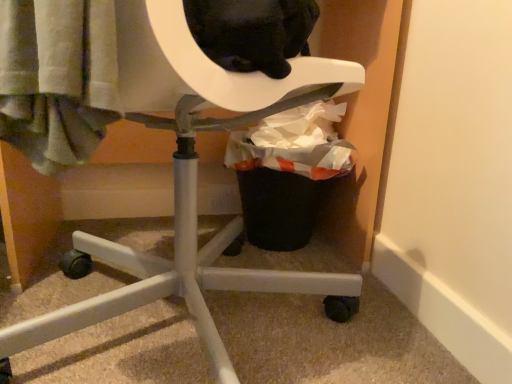
This screenshot has height=384, width=512. Find the location of `white plastic chair at center`. white plastic chair at center is located at coordinates coord(149,127).

What is the approximate width of white plastic chair at center?

24.97 inches.

This screenshot has height=384, width=512. What do you see at coordinates (149, 127) in the screenshot?
I see `white plastic chair at center` at bounding box center [149, 127].

The height and width of the screenshot is (384, 512). Describe the element at coordinates (287, 172) in the screenshot. I see `black plastic trash can at lower right` at that location.

At what (x,y) coordinates should I click in order to perform the action: click on black plastic trash can at lower right. Please return your answer as a coordinate pair (x, y). The image size is (512, 384). Looking at the image, I should click on (287, 172).

Measure the distance between black plastic trash can at lower right and camera.

36.66 inches.

In order to face black plastic trash can at lower right, should I rotate leftwards or rightwards?

To align with it, rotate right about 4.078°.

In order to click on white plastic chair at center in this screenshot , I will do `click(149, 127)`.

Which is more to the left, black plastic trash can at lower right or white plastic chair at center?

white plastic chair at center.

Is black plastic trash can at lower right in front of or behind white plastic chair at center in the image?

black plastic trash can at lower right is behind white plastic chair at center.

Which is closer to the camera, (306, 123) or (55, 30)?

Point (306, 123) is farther from the camera than point (55, 30).

Looking at this image, from the image's perspective, which is below, black plastic trash can at lower right or white plastic chair at center?

From the image's view, white plastic chair at center is below.

From a real-world perspective, who is located lower, black plastic trash can at lower right or white plastic chair at center?

black plastic trash can at lower right.

Considering the sizes of objects black plastic trash can at lower right and white plastic chair at center in the image provided, who is wider, black plastic trash can at lower right or white plastic chair at center?

With larger width is white plastic chair at center.

Who is taller, black plastic trash can at lower right or white plastic chair at center?

Standing taller between the two is white plastic chair at center.

Can you confirm if black plastic trash can at lower right is bigger than white plastic chair at center?

No, black plastic trash can at lower right is not bigger than white plastic chair at center.

Is white plastic chair at center inside black plastic trash can at lower right?

No, white plastic chair at center is not a part of black plastic trash can at lower right.

Would you say black plastic trash can at lower right is a long distance from white plastic chair at center?

No, black plastic trash can at lower right is not far from white plastic chair at center.

Is black plastic trash can at lower right positioned with its back to white plastic chair at center?

black plastic trash can at lower right does not have its back to white plastic chair at center.

Where is `garbage beneath the white plastic chair at center (from a real-world perspective)`? garbage beneath the white plastic chair at center (from a real-world perspective) is located at coordinates (287, 172).

From the picture: Which is more to the left, white plastic chair at center or black plastic trash can at lower right?

From the viewer's perspective, white plastic chair at center appears more on the left side.

Consider the image. Is white plastic chair at center closer to the viewer compared to black plastic trash can at lower right?

Yes, it is.

Is point (150, 273) positioned behind point (273, 148)?

No, (150, 273) is closer to viewer.

From the image's perspective, between white plastic chair at center and black plastic trash can at lower right, which one is located above?

black plastic trash can at lower right is shown above in the image.

From a real-world perspective, which is physically above, white plastic chair at center or black plastic trash can at lower right?

In real-world perspective, white plastic chair at center is above.

Can you confirm if white plastic chair at center is wider than black plastic trash can at lower right?

Indeed, white plastic chair at center has a greater width compared to black plastic trash can at lower right.

Does white plastic chair at center have a greater height compared to black plastic trash can at lower right?

Yes, white plastic chair at center is taller than black plastic trash can at lower right.

Considering the relative sizes of white plastic chair at center and black plastic trash can at lower right in the image provided, is white plastic chair at center smaller than black plastic trash can at lower right?

Actually, white plastic chair at center might be larger than black plastic trash can at lower right.

Can we say white plastic chair at center lies outside black plastic trash can at lower right?

That's correct, white plastic chair at center is outside of black plastic trash can at lower right.

Is white plastic chair at center beside black plastic trash can at lower right?

No, white plastic chair at center is not next to black plastic trash can at lower right.

Is white plastic chair at center looking in the opposite direction of black plastic trash can at lower right?

No, white plastic chair at center is not facing away from black plastic trash can at lower right.

Where is `garbage lying behind the white plastic chair at center`? Image resolution: width=512 pixels, height=384 pixels. garbage lying behind the white plastic chair at center is located at coordinates (287, 172).

Identify the location of garbage on the right of white plastic chair at center. This screenshot has width=512, height=384. (287, 172).

Locate an element on the screen. The width and height of the screenshot is (512, 384). garbage above the white plastic chair at center (from the image's perspective) is located at coordinates (287, 172).